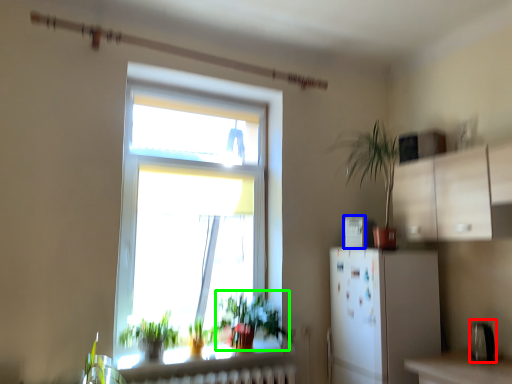
Question: Considering the real-world distances, which object is farthest from appliance (highlighted by a red box)? appliance (highlighted by a blue box) or vegetation (highlighted by a green box)?

Choices:
 (A) appliance
 (B) vegetation

Answer: (B)